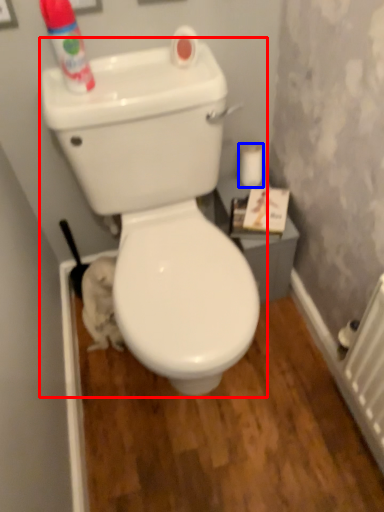
Question: Among these objects, which one is farthest to the camera, toilet (highlighted by a red box) or toilet paper (highlighted by a blue box)?

Choices:
 (A) toilet
 (B) toilet paper

Answer: (B)